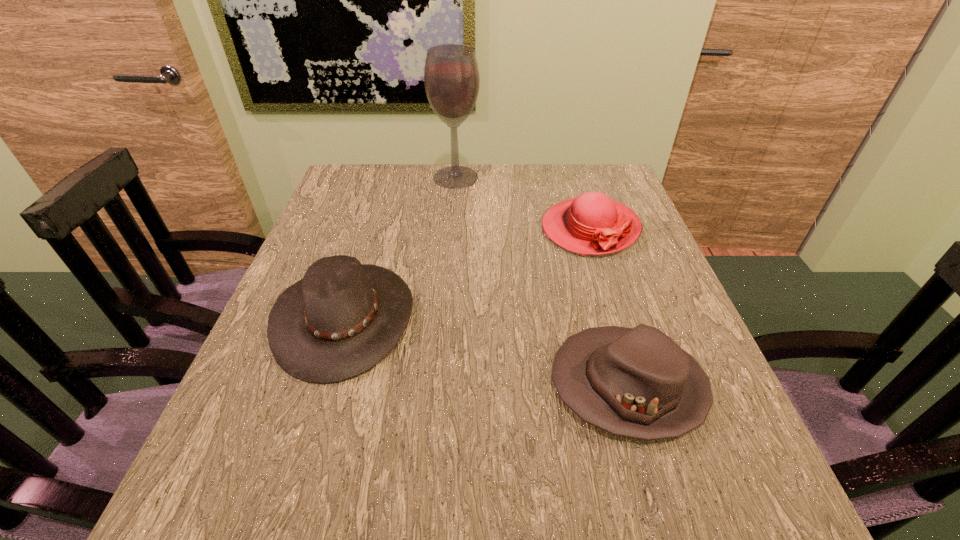
The width and height of the screenshot is (960, 540). In order to click on free space that is in between the second farthest object and the alcohol in this screenshot , I will do `click(523, 203)`.

This screenshot has width=960, height=540. I want to click on empty space that is in between the tallest object and the second farthest object, so click(x=523, y=203).

Choose which object is the third nearest neighbor to the leftmost hat. Please provide its 2D coordinates. Your answer should be formatted as a tuple, i.e. [(x, y)], where the tuple contains the x and y coordinates of a point satisfying the conditions above.

[(451, 76)]

Locate which object is the closest to the leftmost hat. Please provide its 2D coordinates. Your answer should be formatted as a tuple, i.e. [(x, y)], where the tuple contains the x and y coordinates of a point satisfying the conditions above.

[(637, 382)]

Where is `the closest hat to the third nearest object`? The height and width of the screenshot is (540, 960). the closest hat to the third nearest object is located at coordinates (637, 382).

What are the coordinates of `hat identified as the closest to the leftmost hat` in the screenshot? It's located at (637, 382).